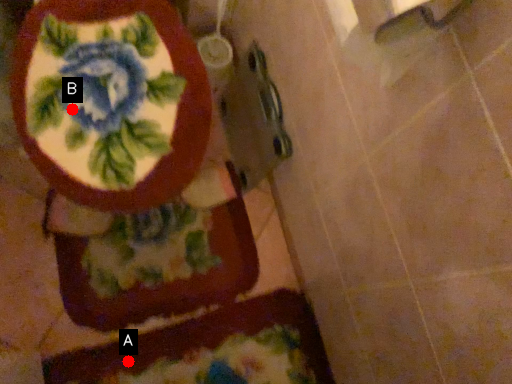
Question: Two points are circled on the image, labeled by A and B beside each circle. Which point appears closest to the camera in this image?

Choices:
 (A) A is closer
 (B) B is closer

Answer: (B)